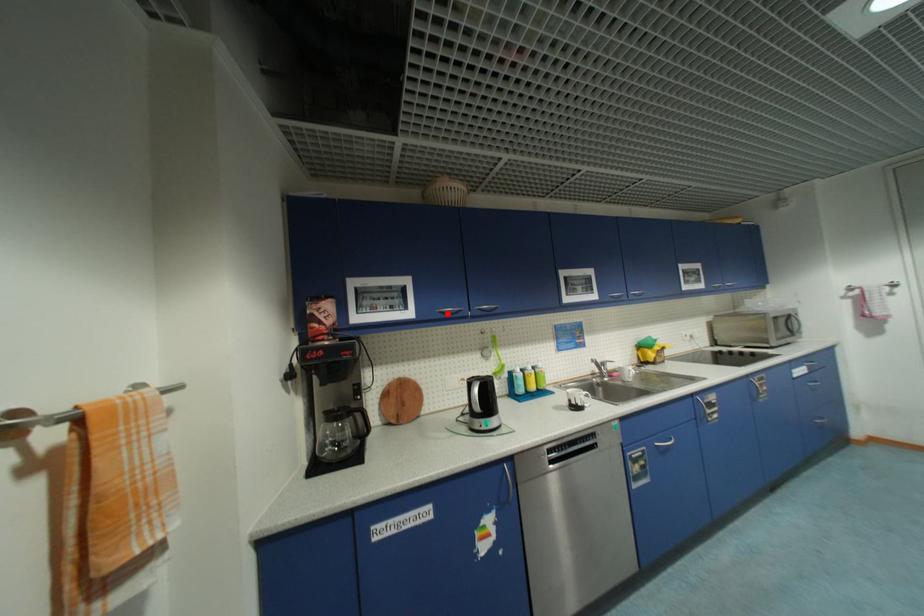
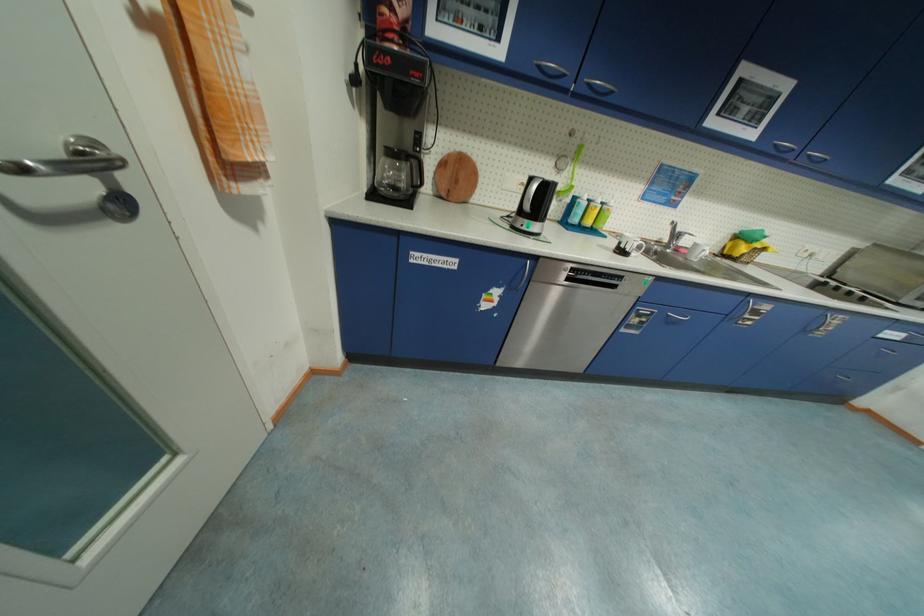
Locate, in the second image, the point that corresponds to the highlighted location in the first image.

(544, 69)